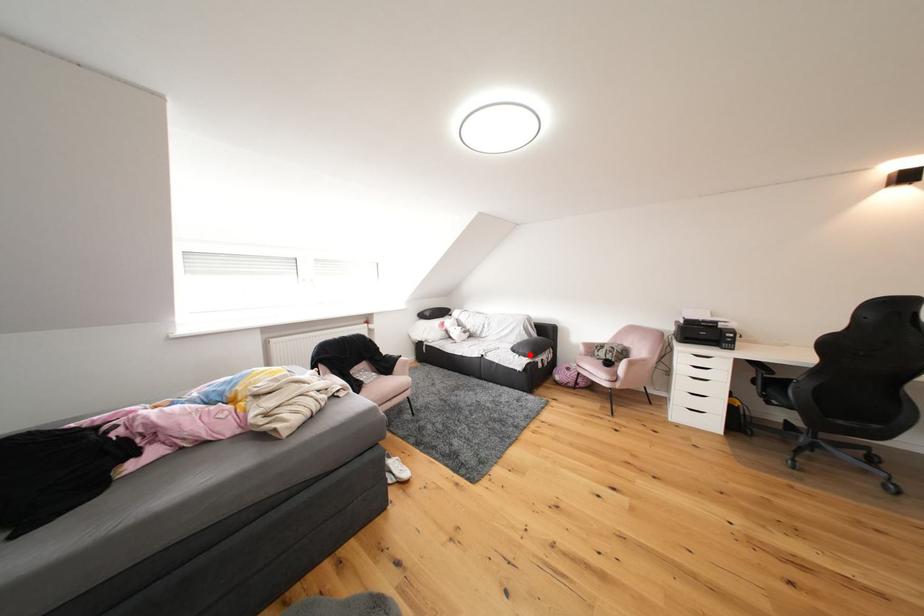
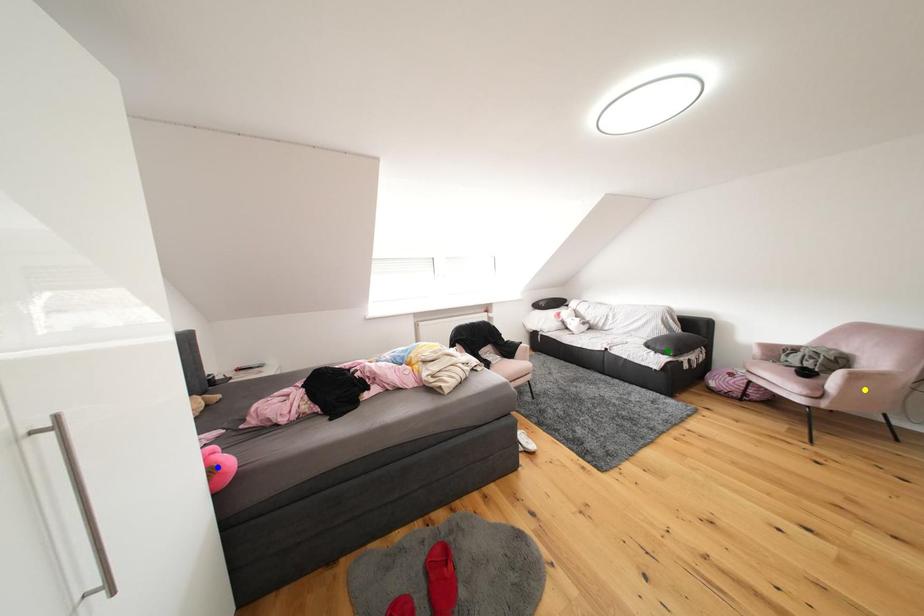
Question: I am providing you with two images of the same scene from different viewpoints. A red point is marked on the first image. You are given multiple points on the second image. Can you choose the point in image 2 that corresponds to the point in image 1?

Choices:
 (A) blue point
 (B) yellow point
 (C) green point

Answer: (C)